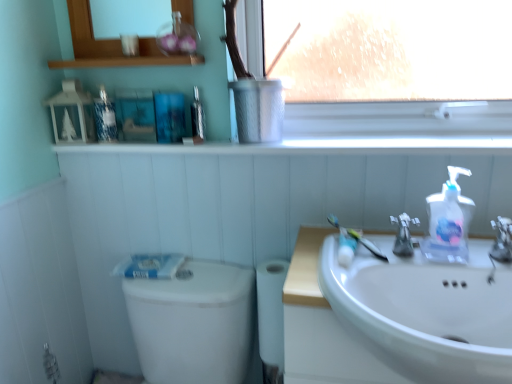
Where is `vacant area located to the right-hand side of satin nickel faucet at sink right, the 2th tap viewed from the right`? The width and height of the screenshot is (512, 384). vacant area located to the right-hand side of satin nickel faucet at sink right, the 2th tap viewed from the right is located at coordinates (468, 263).